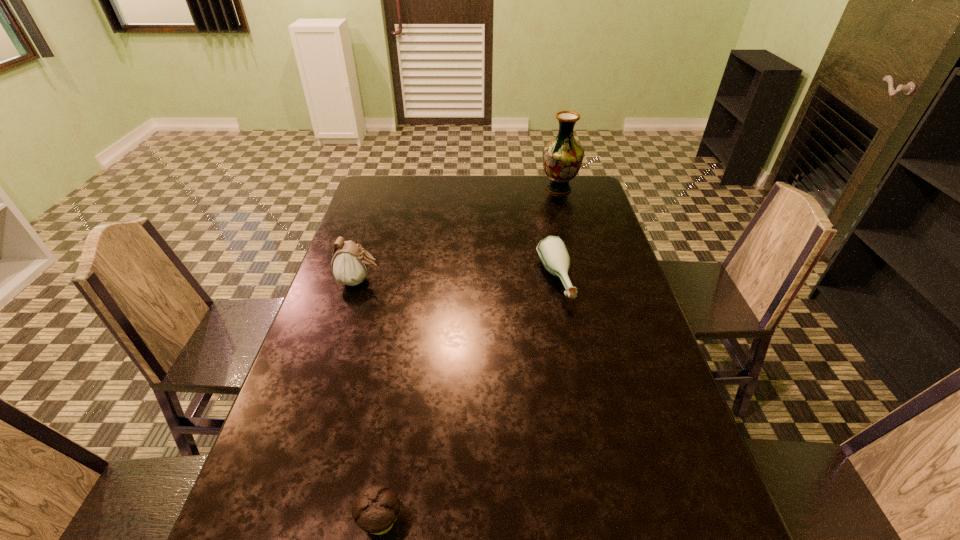
Image resolution: width=960 pixels, height=540 pixels. Identify the location of object present at the right edge. (562, 157).

The height and width of the screenshot is (540, 960). Identify the location of object that is at the far right corner. click(562, 157).

At what (x,y) coordinates should I click in order to perform the action: click on free region at the far edge. Please return your answer as a coordinate pair (x, y). This screenshot has width=960, height=540. Looking at the image, I should click on (419, 207).

This screenshot has width=960, height=540. Find the location of `free space at the left edge of the desktop`. free space at the left edge of the desktop is located at coordinates (368, 335).

You are a GUI agent. You are given a task and a screenshot of the screen. Output one action in this format:
    pyautogui.click(x=<x>, y=<y>)
    Task: Click on the vacant space at the right edge
    
    Given the screenshot: What is the action you would take?
    pyautogui.click(x=693, y=510)

Where is `free spot at the far right corner of the desktop`? This screenshot has height=540, width=960. free spot at the far right corner of the desktop is located at coordinates (565, 197).

Image resolution: width=960 pixels, height=540 pixels. I want to click on blank region between the bottle and the tallest object, so click(x=557, y=234).

At what (x,y) coordinates should I click in order to perform the action: click on free area in between the bottle and the vase. Please return your answer as a coordinate pair (x, y). This screenshot has height=540, width=960. Looking at the image, I should click on (557, 234).

Find the location of `unoccupied position between the leftmost object and the vase`. unoccupied position between the leftmost object and the vase is located at coordinates (459, 234).

I want to click on free spot between the leftmost object and the bottle, so click(x=457, y=281).